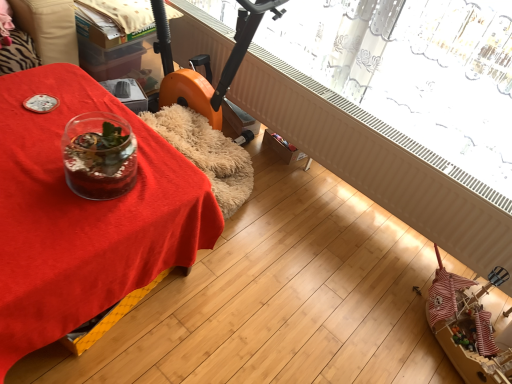
Question: Is transparent glass vase at left inside the boundaries of transparent glass window at upper center, or outside?

Choices:
 (A) inside
 (B) outside

Answer: (B)

Question: Is transparent glass vase at left in front of or behind transparent glass window at upper center in the image?

Choices:
 (A) behind
 (B) front

Answer: (B)

Question: From a real-world perspective, relative to transparent glass window at upper center, is transparent glass vase at left vertically above or below?

Choices:
 (A) below
 (B) above

Answer: (A)

Question: In terms of size, does transparent glass window at upper center appear bigger or smaller than transparent glass vase at left?

Choices:
 (A) small
 (B) big

Answer: (A)

Question: In terms of height, does transparent glass window at upper center look taller or shorter compared to transparent glass vase at left?

Choices:
 (A) tall
 (B) short

Answer: (B)

Question: Considering the positions of point (425, 157) and point (14, 225), is point (425, 157) closer or farther from the camera than point (14, 225)?

Choices:
 (A) closer
 (B) farther

Answer: (B)

Question: Based on their positions, is transparent glass window at upper center located to the left or right of transparent glass vase at left?

Choices:
 (A) left
 (B) right

Answer: (B)